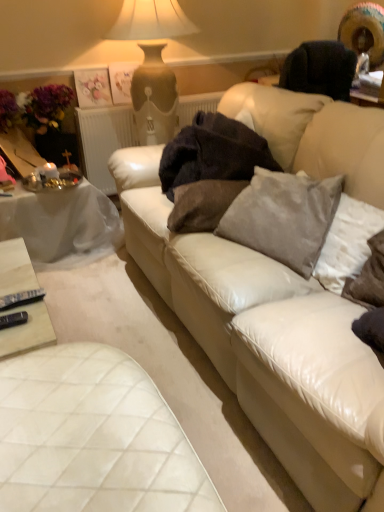
Question: Considering the relative positions of white textured radiator at upper center and white cloth-covered table at left, acting as the first table starting from the top, in the image provided, is white textured radiator at upper center to the left of white cloth-covered table at left, acting as the first table starting from the top, from the viewer's perspective?

Choices:
 (A) yes
 (B) no

Answer: (B)

Question: Is white textured radiator at upper center at the right side of white cloth-covered table at left, placed as the 1th table when sorted from back to front?

Choices:
 (A) yes
 (B) no

Answer: (A)

Question: From a real-world perspective, does white textured radiator at upper center sit lower than white cloth-covered table at left, acting as the first table starting from the top?

Choices:
 (A) yes
 (B) no

Answer: (B)

Question: Are white textured radiator at upper center and white cloth-covered table at left, acting as the first table starting from the top, far apart?

Choices:
 (A) no
 (B) yes

Answer: (A)

Question: Can you confirm if white textured radiator at upper center is bigger than white cloth-covered table at left, positioned as the second table in bottom-to-top order?

Choices:
 (A) no
 (B) yes

Answer: (A)

Question: Looking at the image, does gray velvety pillow at right, which is counted as the 1th pillow, starting from the right, seem bigger or smaller compared to white cloth-covered table at left, placed as the 1th table when sorted from back to front?

Choices:
 (A) big
 (B) small

Answer: (B)

Question: Considering the positions of gray velvety pillow at right, the third pillow positioned from the left, and white cloth-covered table at left, the second table viewed from the front, in the image, is gray velvety pillow at right, the third pillow positioned from the left, wider or thinner than white cloth-covered table at left, the second table viewed from the front,?

Choices:
 (A) wide
 (B) thin

Answer: (B)

Question: Is gray velvety pillow at right, the third pillow positioned from the left, taller or shorter than white cloth-covered table at left, placed as the 1th table when sorted from back to front?

Choices:
 (A) short
 (B) tall

Answer: (A)

Question: Considering the relative positions of gray velvety pillow at right, which is counted as the 1th pillow, starting from the right, and white cloth-covered table at left, placed as the 1th table when sorted from back to front, in the image provided, is gray velvety pillow at right, which is counted as the 1th pillow, starting from the right, to the left or to the right of white cloth-covered table at left, placed as the 1th table when sorted from back to front,?

Choices:
 (A) left
 (B) right

Answer: (B)

Question: Is gray velvety pillow at right, the third pillow positioned from the left, bigger or smaller than velvet gray pillow at center, placed as the 1th pillow when sorted from left to right?

Choices:
 (A) big
 (B) small

Answer: (B)

Question: Relative to velvet gray pillow at center, placed as the 3th pillow when sorted from right to left, is gray velvety pillow at right, which is counted as the 1th pillow, starting from the right, in front or behind?

Choices:
 (A) behind
 (B) front

Answer: (B)

Question: Does point (339, 247) appear closer or farther from the camera than point (210, 179)?

Choices:
 (A) closer
 (B) farther

Answer: (A)

Question: In terms of height, does gray velvety pillow at right, which is counted as the 1th pillow, starting from the right, look taller or shorter compared to velvet gray pillow at center, placed as the 3th pillow when sorted from right to left?

Choices:
 (A) tall
 (B) short

Answer: (A)

Question: Considering the positions of point coord(125,140) and point coord(278,316), is point coord(125,140) closer or farther from the camera than point coord(278,316)?

Choices:
 (A) closer
 (B) farther

Answer: (B)

Question: In terms of size, does white textured radiator at upper center appear bigger or smaller than white leather couch at center?

Choices:
 (A) small
 (B) big

Answer: (A)